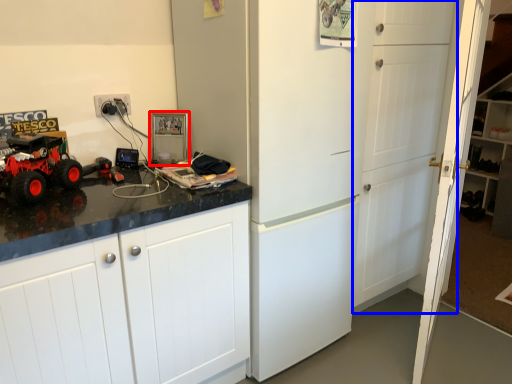
Question: Which point is further to the camera, appliance (highlighted by a red box) or door (highlighted by a blue box)?

Choices:
 (A) appliance
 (B) door

Answer: (A)